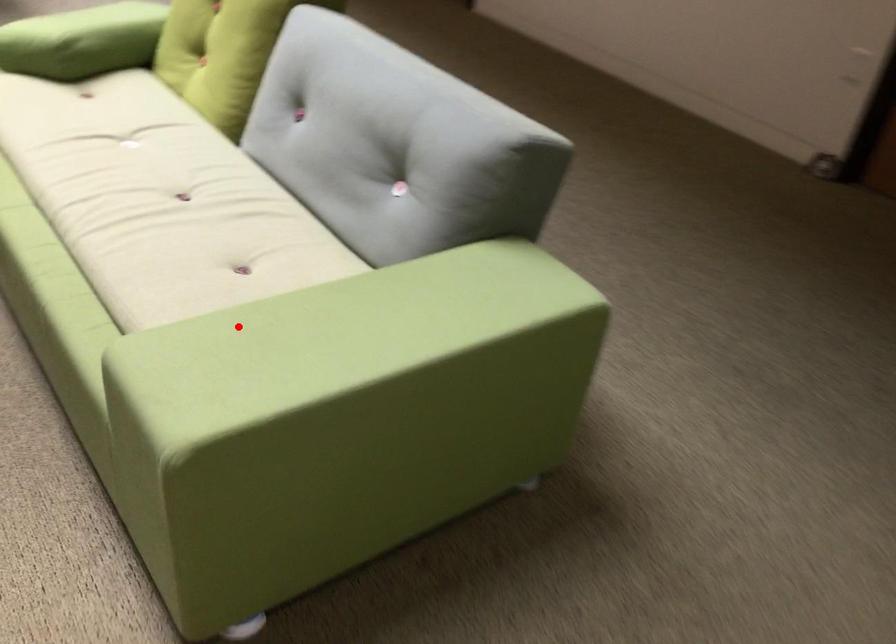
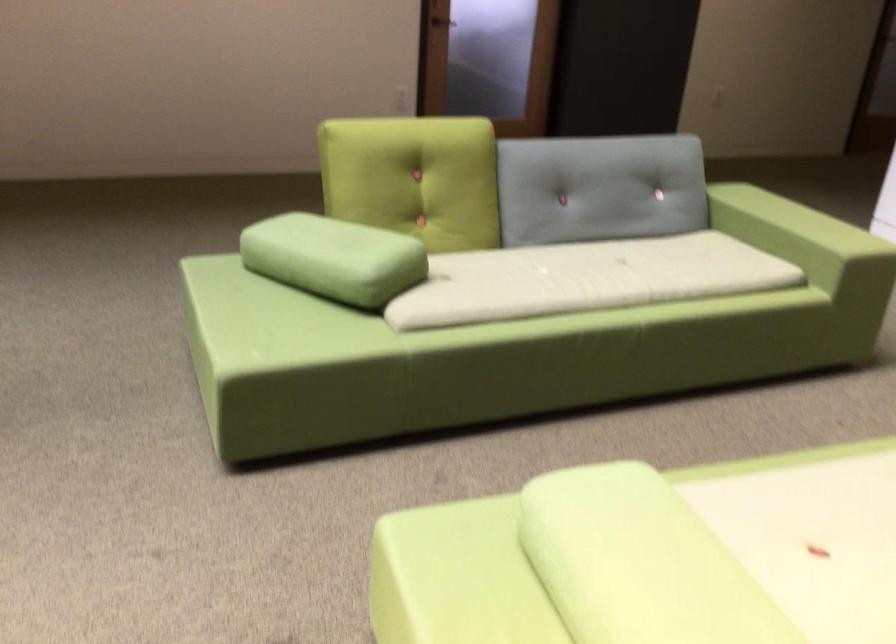
Question: A red point is marked in image1. In image2, is the corresponding 3D point closer to the camera or farther? Reply with the corresponding letter.

Choices:
 (A) The corresponding 3D point is closer.
 (B) The corresponding 3D point is farther.

Answer: (B)